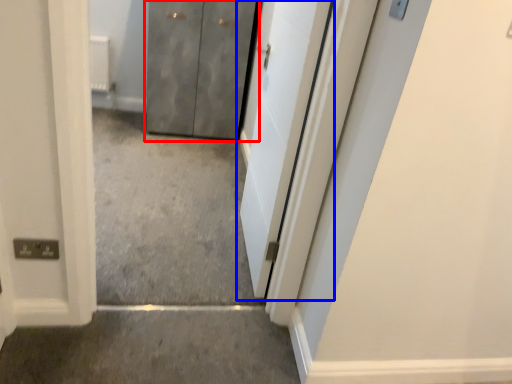
Question: Which object is further to the camera taking this photo, door (highlighted by a red box) or door (highlighted by a blue box)?

Choices:
 (A) door
 (B) door

Answer: (A)